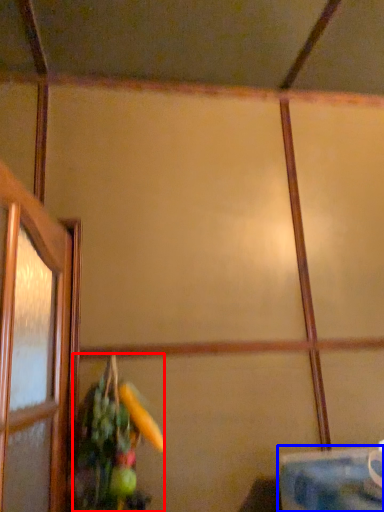
Question: Which of the following is the closest to the observer, floral arrangement (highlighted by a red box) or table (highlighted by a blue box)?

Choices:
 (A) floral arrangement
 (B) table

Answer: (B)